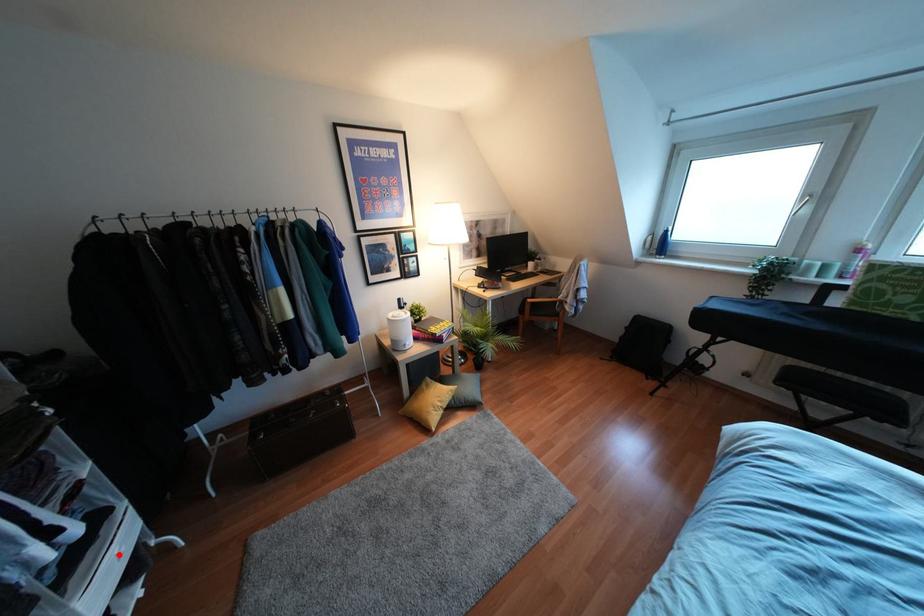
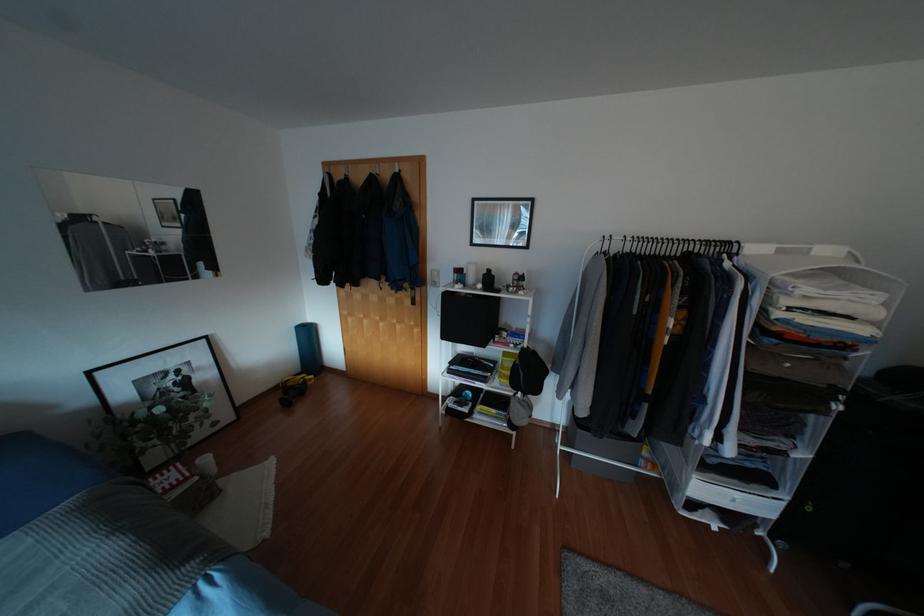
Question: I am providing you with two images of the same scene from different viewpoints. Given a red point in image1, look at the same physical point in image2. Is it:

Choices:
 (A) Closer to the viewpoint
 (B) Farther from the viewpoint

Answer: (A)